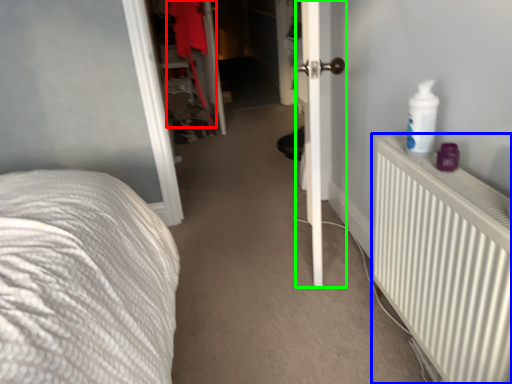
Question: Considering the real-world distances, which object is farthest from clothing (highlighted by a red box)? radiator (highlighted by a blue box) or door (highlighted by a green box)?

Choices:
 (A) radiator
 (B) door

Answer: (A)